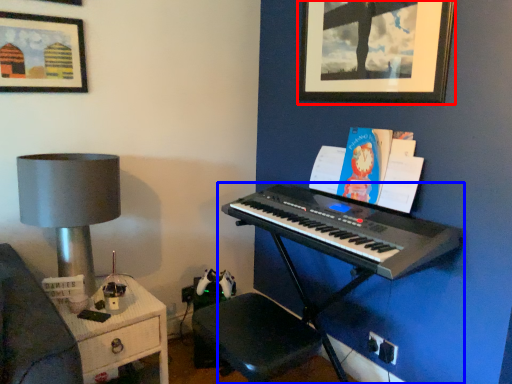
Question: Which object appears closest to the camera in this image, picture frame (highlighted by a red box) or piano (highlighted by a blue box)?

Choices:
 (A) picture frame
 (B) piano

Answer: (B)